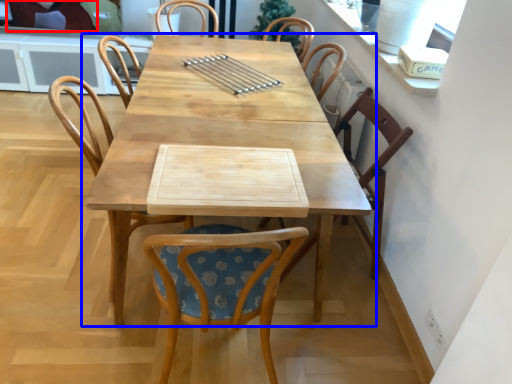
Question: Which object appears farthest to the camera in this image, couple (highlighted by a red box) or table (highlighted by a blue box)?

Choices:
 (A) couple
 (B) table

Answer: (A)